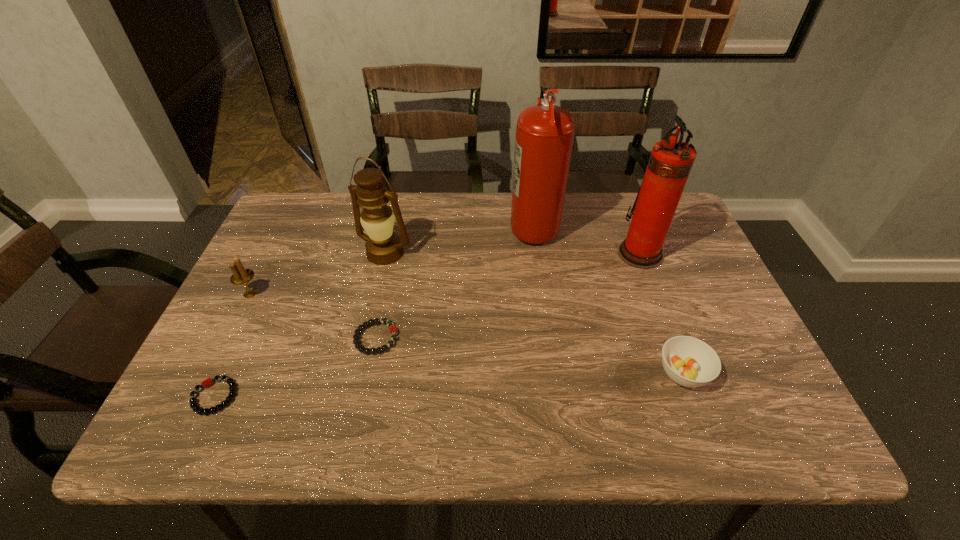
Where is `vacant space located on the instruction side of the left fire extinguisher`? vacant space located on the instruction side of the left fire extinguisher is located at coordinates (405, 225).

Find the location of a particular element. The height and width of the screenshot is (540, 960). vacant space located 0.250m on the instruction side of the left fire extinguisher is located at coordinates coord(425,225).

What are the coordinates of `blank space located at the discharge end of the sixth shortest object` in the screenshot? It's located at [x=574, y=253].

You are a GUI agent. You are given a task and a screenshot of the screen. Output one action in this format:
    pyautogui.click(x=<x>, y=<y>)
    Task: Click on the vacant space located 0.310m at the discharge end of the sixth shortest object
    The width and height of the screenshot is (960, 540).
    Given the screenshot: What is the action you would take?
    pyautogui.click(x=506, y=253)

Where is `vacant region located at the discharge end of the sixth shortest object`? vacant region located at the discharge end of the sixth shortest object is located at coordinates (600, 253).

Locate an element on the screen. This screenshot has height=540, width=960. free space located 0.180m on the right of the fifth shortest object is located at coordinates (476, 253).

Find the location of a particular element. Image resolution: width=960 pixels, height=540 pixels. vacant space located on the front of the fourth farthest object is located at coordinates (232, 330).

Identify the location of free spot located on the back of the third shortest object. This screenshot has height=540, width=960. (649, 284).

Where is `free space located 0.220m on the back of the right bracelet`? free space located 0.220m on the back of the right bracelet is located at coordinates (393, 259).

Locate an element on the screen. The image size is (960, 540). free space located on the back of the nearer bracelet is located at coordinates (268, 284).